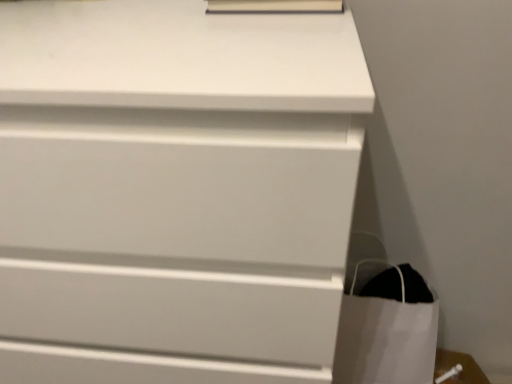
Where is `space that is in front of matte white book at upper center`? space that is in front of matte white book at upper center is located at coordinates (256, 39).